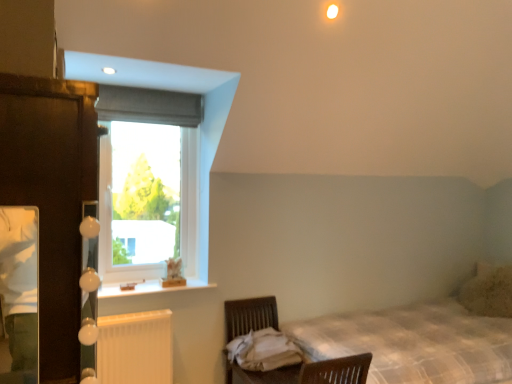
Question: Is white wood at upper left facing towards plaid fabric bed at lower right?

Choices:
 (A) no
 (B) yes

Answer: (A)

Question: From a real-world perspective, is white wood at upper left physically above plaid fabric bed at lower right?

Choices:
 (A) yes
 (B) no

Answer: (A)

Question: Can you confirm if white wood at upper left is taller than plaid fabric bed at lower right?

Choices:
 (A) no
 (B) yes

Answer: (A)

Question: Is white wood at upper left oriented away from plaid fabric bed at lower right?

Choices:
 (A) yes
 (B) no

Answer: (B)

Question: Can you confirm if white wood at upper left is smaller than plaid fabric bed at lower right?

Choices:
 (A) yes
 (B) no

Answer: (A)

Question: Is white wood at upper left bigger than plaid fabric bed at lower right?

Choices:
 (A) yes
 (B) no

Answer: (B)

Question: Would you say beige textured pillow at right contains dark wood armoire at left?

Choices:
 (A) no
 (B) yes

Answer: (A)

Question: Are beige textured pillow at right and dark wood armoire at left located far from each other?

Choices:
 (A) yes
 (B) no

Answer: (A)

Question: Does beige textured pillow at right have a smaller size compared to dark wood armoire at left?

Choices:
 (A) no
 (B) yes

Answer: (B)

Question: Is beige textured pillow at right aimed at dark wood armoire at left?

Choices:
 (A) yes
 (B) no

Answer: (A)

Question: Can you confirm if beige textured pillow at right is positioned to the right of dark wood armoire at left?

Choices:
 (A) yes
 (B) no

Answer: (A)

Question: Can you confirm if beige textured pillow at right is shorter than dark wood armoire at left?

Choices:
 (A) no
 (B) yes

Answer: (B)

Question: Can you confirm if beige textured pillow at right is positioned to the right of white plastic radiator at lower left?

Choices:
 (A) no
 (B) yes

Answer: (B)